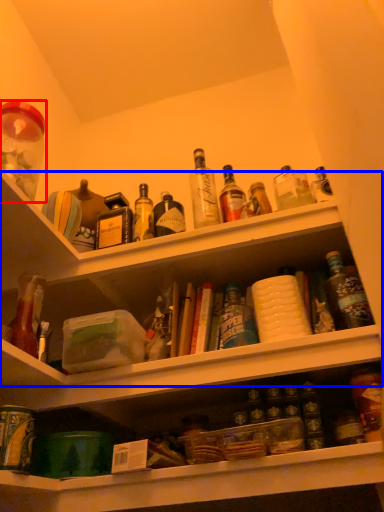
Question: Which object is further to the camera taking this photo, beverage (highlighted by a red box) or shelf (highlighted by a blue box)?

Choices:
 (A) beverage
 (B) shelf

Answer: (B)